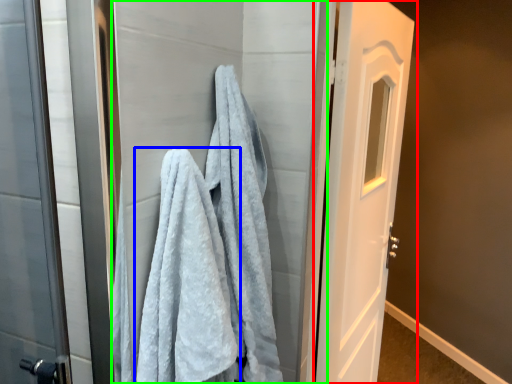
Question: Considering the real-world distances, which object is closest to door (highlighted by a red box)? towel (highlighted by a blue box) or screen door (highlighted by a green box).

Choices:
 (A) towel
 (B) screen door

Answer: (B)